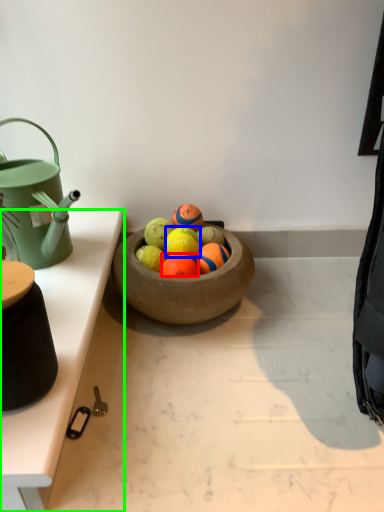
Question: Which object is positioned closest to fruit (highlighted by a red box)? Select from fruit (highlighted by a blue box) and table (highlighted by a green box).

Choices:
 (A) fruit
 (B) table

Answer: (A)